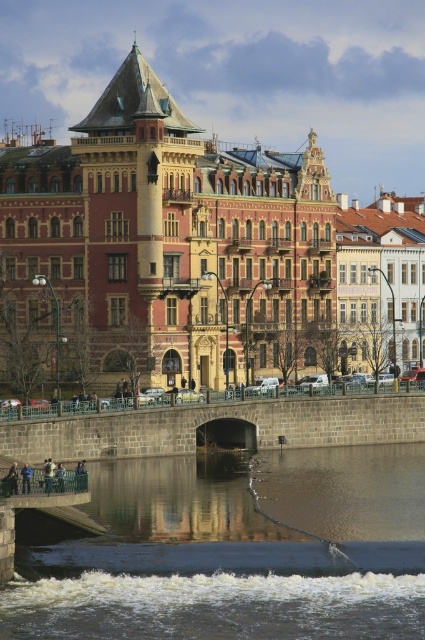
You are an architect designing a new pathway that needs to cross both the smooth concrete river at center and the green metal bridge at lower left. Which one requires a wider bridge design to accommodate the crossing?

The smooth concrete river at center requires a wider bridge design because its width is larger than the green metal bridge at lower left.

You are a tourist standing on the green metal bridge at lower left and want to take a photo of the smooth concrete river at center. Which direction should you look to capture the river in your shot?

You should look downward because the smooth concrete river at center is located below the green metal bridge at lower left.